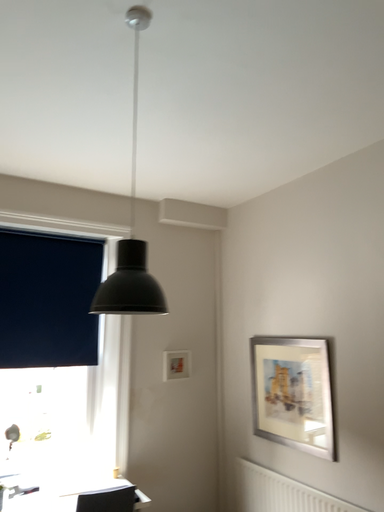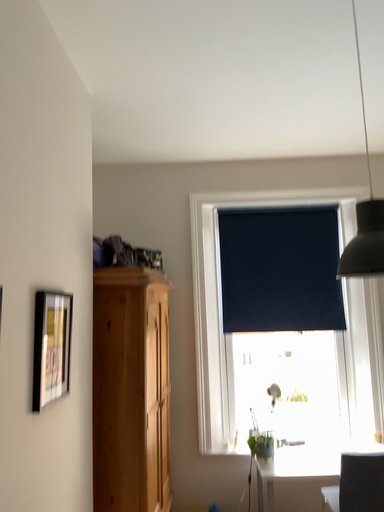
Question: How did the camera likely rotate when shooting the video?

Choices:
 (A) rotated downward
 (B) rotated upward

Answer: (A)